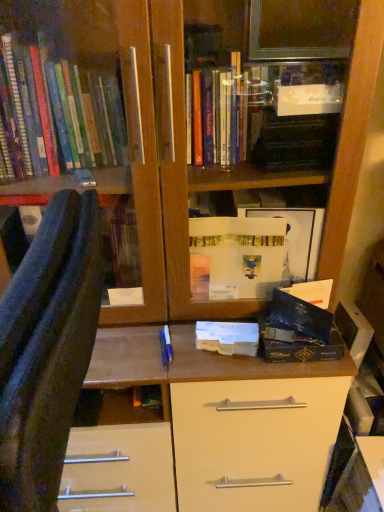
Question: Looking at the image, does blue fabric chair at left seem bigger or smaller compared to white matte paper at center?

Choices:
 (A) big
 (B) small

Answer: (A)

Question: Is blue fabric chair at left inside or outside of white matte paper at center?

Choices:
 (A) inside
 (B) outside

Answer: (B)

Question: From a real-world perspective, is blue fabric chair at left above or below white matte paper at center?

Choices:
 (A) above
 (B) below

Answer: (A)

Question: From the image's perspective, is white matte paper at center located above or below blue fabric chair at left?

Choices:
 (A) below
 (B) above

Answer: (B)

Question: Considering the positions of white matte paper at center and blue fabric chair at left in the image, is white matte paper at center wider or thinner than blue fabric chair at left?

Choices:
 (A) wide
 (B) thin

Answer: (B)

Question: From a real-world perspective, is white matte paper at center above or below blue fabric chair at left?

Choices:
 (A) above
 (B) below

Answer: (B)

Question: In terms of height, does white matte paper at center look taller or shorter compared to blue fabric chair at left?

Choices:
 (A) short
 (B) tall

Answer: (A)